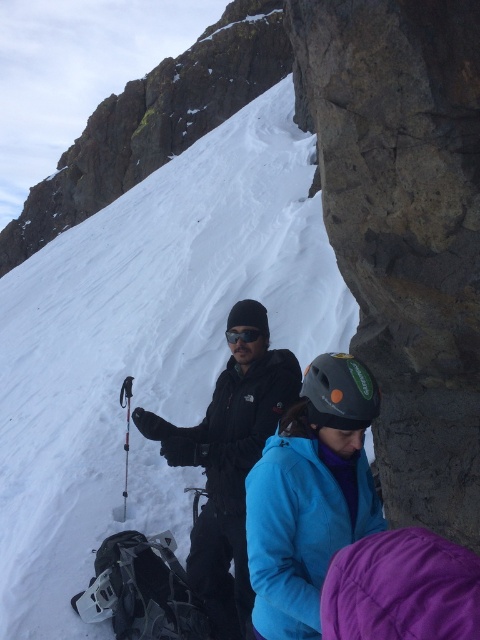
Does white powder snow at center appear on the left side of dark gray stone at right?

Correct, you'll find white powder snow at center to the left of dark gray stone at right.

Can you confirm if white powder snow at center is taller than dark gray stone at right?

Correct, white powder snow at center is much taller as dark gray stone at right.

Is point (50, 481) behind point (297, 118)?

No, it is in front of (297, 118).

The width and height of the screenshot is (480, 640). What are the coordinates of `white powder snow at center` in the screenshot? It's located at (146, 346).

Does white powder snow at center have a lesser width compared to black matte goggles at center?

No, white powder snow at center is not thinner than black matte goggles at center.

Does white powder snow at center appear on the right side of black matte goggles at center?

Incorrect, white powder snow at center is not on the right side of black matte goggles at center.

Which is behind, point (215, 332) or point (255, 332)?

Positioned behind is point (215, 332).

Where is `white powder snow at center`? This screenshot has width=480, height=640. white powder snow at center is located at coordinates (146, 346).

Looking at this image, how distant is dark gray stone at right from matte blue jacket at center?

They are 4.52 feet apart.

Can you confirm if dark gray stone at right is taller than matte blue jacket at center?

Correct, dark gray stone at right is much taller as matte blue jacket at center.

Which is in front, point (393, 13) or point (299, 596)?

Point (299, 596)

You are a GUI agent. You are given a task and a screenshot of the screen. Output one action in this format:
    pyautogui.click(x=<x>, y=<y>)
    Task: Click on the dark gray stone at right
    
    Given the screenshot: What is the action you would take?
    pyautogui.click(x=405, y=228)